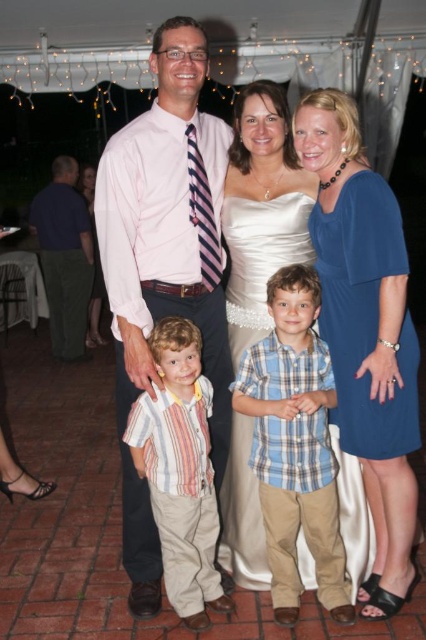
Question: Which object appears closest to the camera in this image?

Choices:
 (A) blue plaid shirt at center
 (B) dark blue shirt at left

Answer: (A)

Question: Considering the relative positions of blue satin dress at center and satin dress at center in the image provided, where is blue satin dress at center located with respect to satin dress at center?

Choices:
 (A) left
 (B) right

Answer: (B)

Question: Which point is closer to the camera?

Choices:
 (A) (302, 577)
 (B) (227, 384)
 (C) (322, 129)
 (D) (345, 310)

Answer: (C)

Question: Does pink shirt at center appear on the right side of blue plaid shirt at center?

Choices:
 (A) no
 (B) yes

Answer: (A)

Question: Which of these objects is positioned closest to the satin dress at center?

Choices:
 (A) dark blue shirt at left
 (B) blue satin dress at center
 (C) blue plaid shirt at center
 (D) blue jersey dress at right

Answer: (D)

Question: Where is pink shirt at center located in relation to blue plaid shirt at center in the image?

Choices:
 (A) right
 (B) left

Answer: (B)